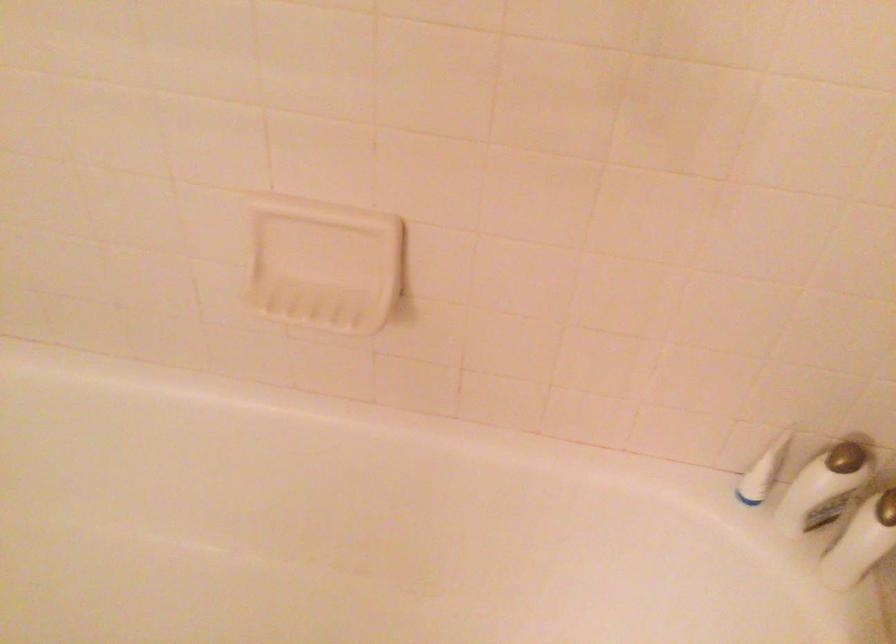
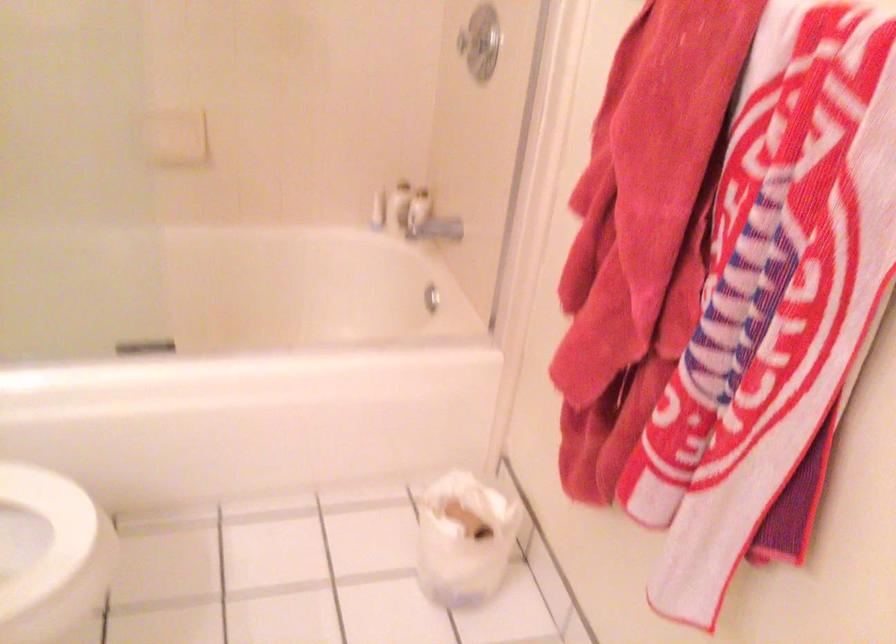
Where in the second image is the point corresponding to the point at 754,478 from the first image?

(378, 211)